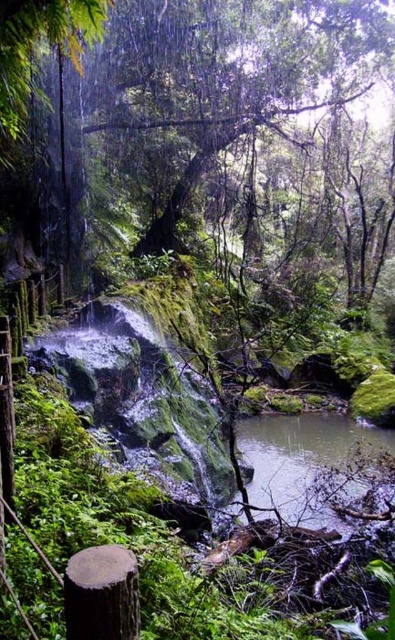
Question: Does green mossy stream at lower center come in front of brown rough tree stump at lower left?

Choices:
 (A) no
 (B) yes

Answer: (A)

Question: Is green mossy stream at lower center above brown rough tree stump at lower left?

Choices:
 (A) no
 (B) yes

Answer: (A)

Question: Is green mossy stream at lower center positioned behind brown rough tree stump at lower left?

Choices:
 (A) no
 (B) yes

Answer: (B)

Question: Which point is farther from the camera taking this photo?

Choices:
 (A) (314, 490)
 (B) (109, 593)

Answer: (A)

Question: Which point is farther from the camera taking this photo?

Choices:
 (A) (285, 467)
 (B) (101, 580)

Answer: (A)